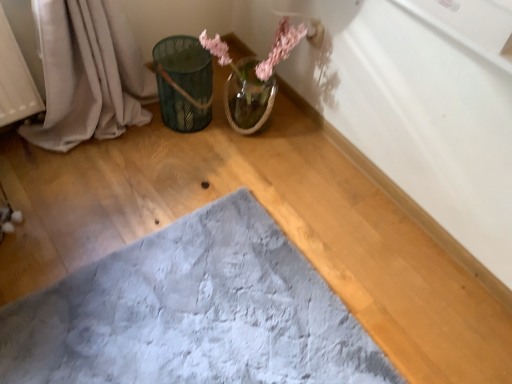
You are a GUI agent. You are given a task and a screenshot of the screen. Output one action in this format:
    pyautogui.click(x=<x>, y=<y>)
    Task: Click on the free space above soft gray plush bath mat at center (from a real-world perspective)
    
    Given the screenshot: What is the action you would take?
    pyautogui.click(x=158, y=332)